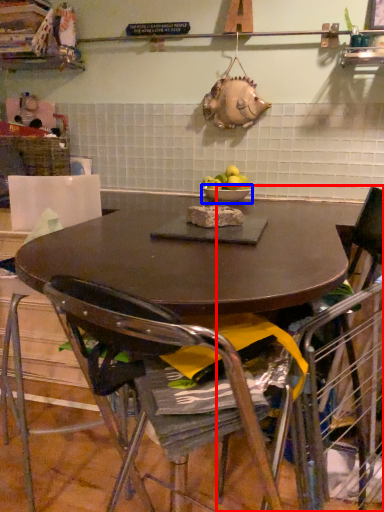
Question: Which object appears closest to the camera in this image, chair (highlighted by a red box) or bowl (highlighted by a blue box)?

Choices:
 (A) chair
 (B) bowl

Answer: (A)